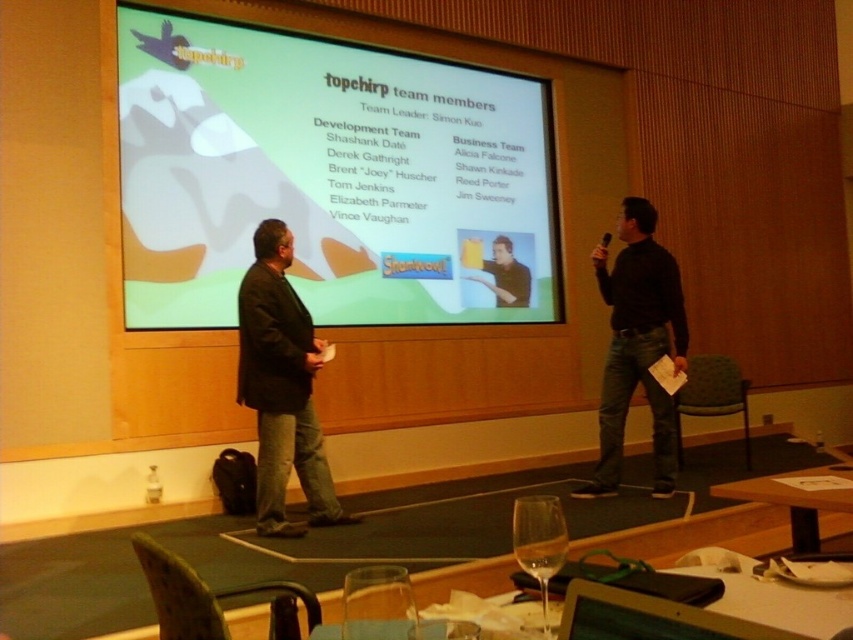
Between dark brown leather jacket at center and transparent glass at lower center, which one appears on the right side from the viewer's perspective?

transparent glass at lower center is more to the right.

Is the position of dark brown leather jacket at center less distant than that of transparent glass at lower center?

No, it is not.

Describe the element at coordinates (281, 387) in the screenshot. This screenshot has width=853, height=640. I see `dark brown leather jacket at center` at that location.

The width and height of the screenshot is (853, 640). Find the location of `dark brown leather jacket at center`. dark brown leather jacket at center is located at coordinates (281, 387).

Does white matte projection screen at upper center appear on the left side of dark brown leather jacket at center?

No, white matte projection screen at upper center is not to the left of dark brown leather jacket at center.

Is point (212, 186) farther from camera compared to point (296, 300)?

Yes, point (212, 186) is farther from viewer.

What do you see at coordinates (326, 176) in the screenshot? I see `white matte projection screen at upper center` at bounding box center [326, 176].

Image resolution: width=853 pixels, height=640 pixels. In order to click on white matte projection screen at upper center in this screenshot , I will do `click(326, 176)`.

Does point (616, 257) lie in front of point (525, 285)?

Yes, it is in front of point (525, 285).

Is black matte sweater at center to the left of matte black shirt at center from the viewer's perspective?

In fact, black matte sweater at center is to the right of matte black shirt at center.

Who is more distant from viewer, (656, 276) or (505, 266)?

The point (505, 266) is behind.

The height and width of the screenshot is (640, 853). I want to click on black matte sweater at center, so click(637, 346).